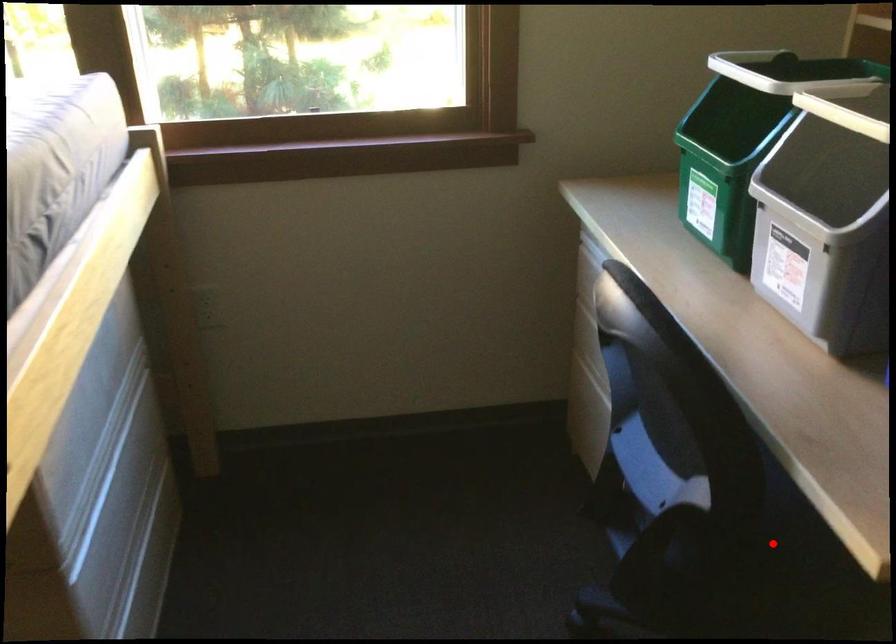
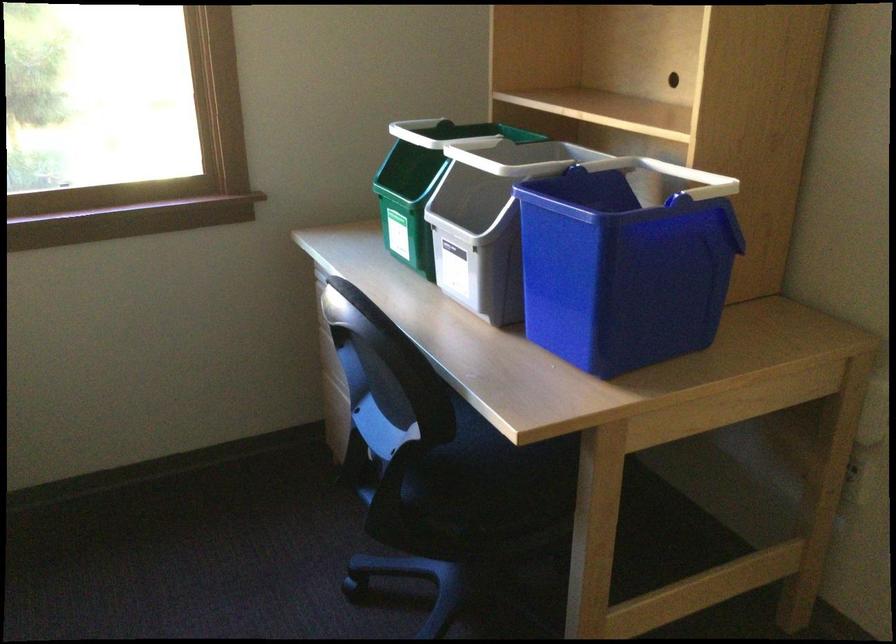
The point at the highlighted location is marked in the first image. Where is the corresponding point in the second image?

(479, 476)